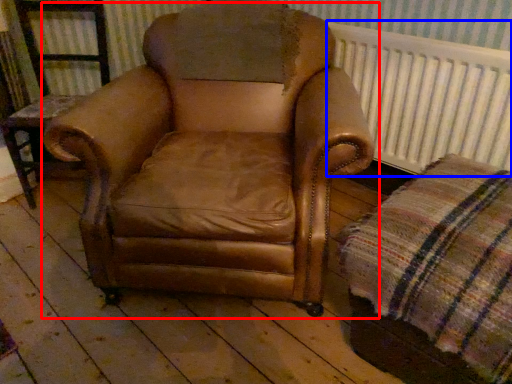
Question: Which object appears closest to the camera in this image, chair (highlighted by a red box) or radiator (highlighted by a blue box)?

Choices:
 (A) chair
 (B) radiator

Answer: (A)